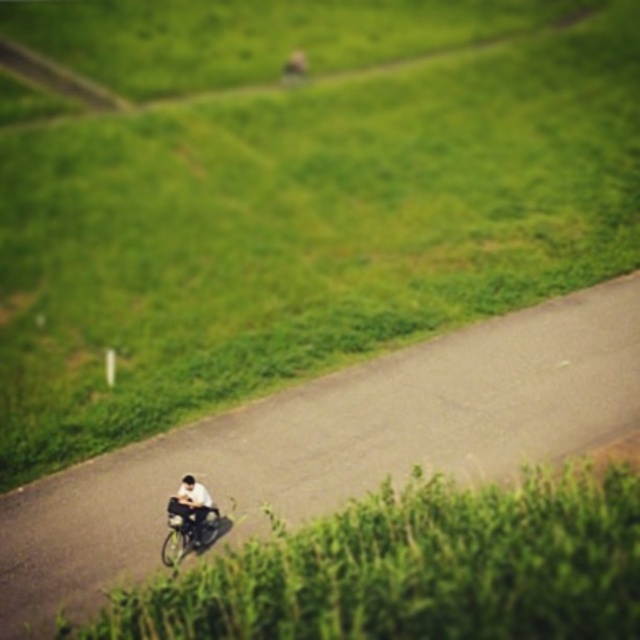
You are standing at the top of a hill overlooking the scene. You see the asphalt road at center and the metallic silver bicycle at center. Which object is closer to you?

The asphalt road at center is closer to you because it is in front of the metallic silver bicycle at center.